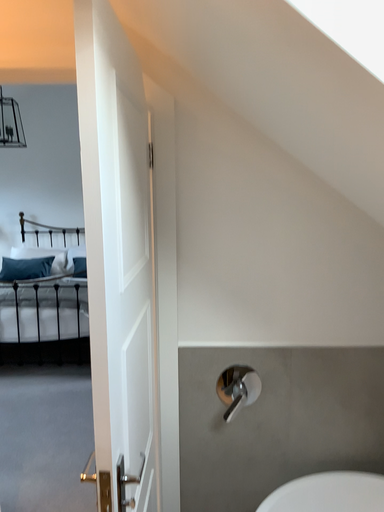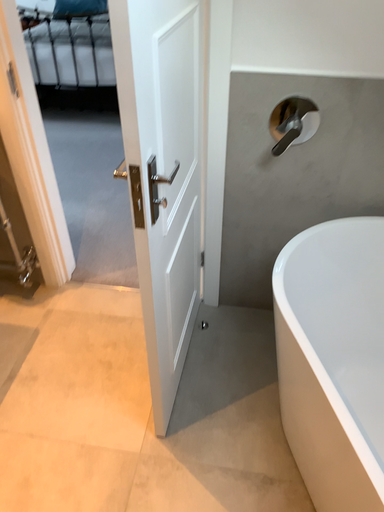
Question: How did the camera likely rotate when shooting the video?

Choices:
 (A) rotated downward
 (B) rotated upward

Answer: (A)